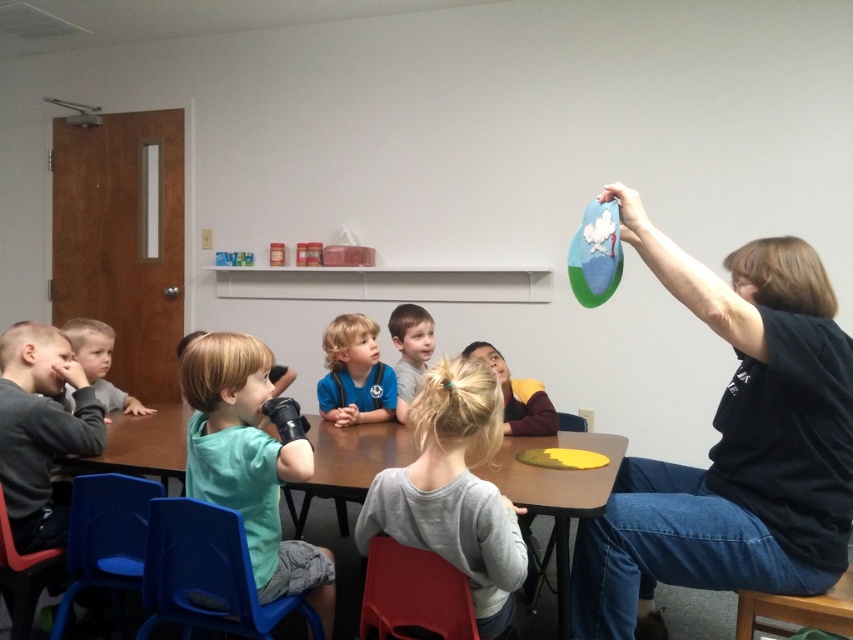
Question: Does black felt board at upper right have a lesser width compared to light brown hair at center?

Choices:
 (A) yes
 (B) no

Answer: (B)

Question: Which point appears farthest from the camera in this image?

Choices:
 (A) (198, 392)
 (B) (90, 346)
 (C) (728, 266)

Answer: (B)

Question: Does black felt board at upper right have a lesser width compared to smooth gray shirt at left?

Choices:
 (A) no
 (B) yes

Answer: (A)

Question: Which object appears farthest from the camera in this image?

Choices:
 (A) light brown hair at center
 (B) black felt board at upper right
 (C) blue matte shirt at center

Answer: (A)

Question: Which point appears farthest from the camera in this image?

Choices:
 (A) (375, 413)
 (B) (416, 358)

Answer: (B)

Question: Can you confirm if black felt board at upper right is thinner than light brown hair at center?

Choices:
 (A) no
 (B) yes

Answer: (A)